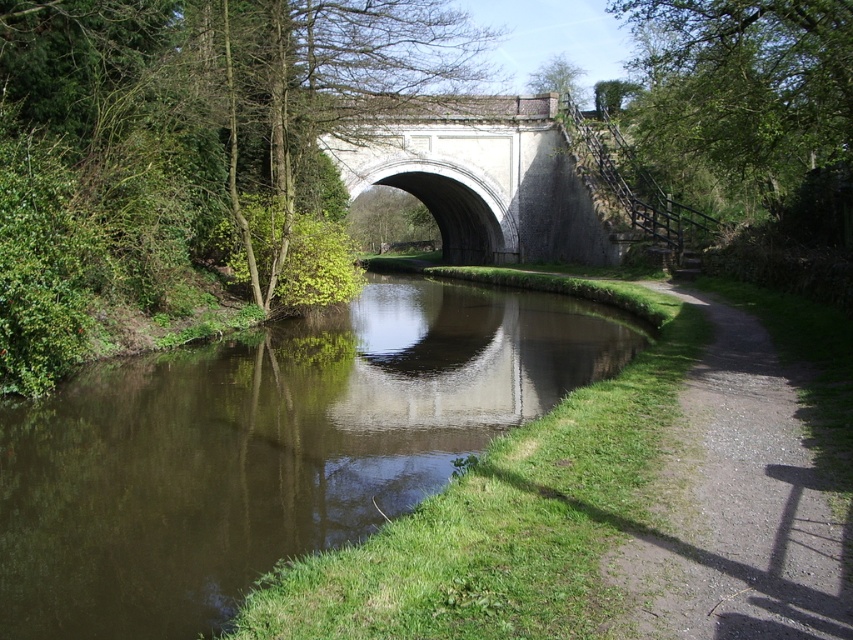
You are standing at the point marked as point (265, 448) in the canal scene. What do you see directly beneath your feet?

You see brown reflective water at center directly beneath your feet at point (265, 448).